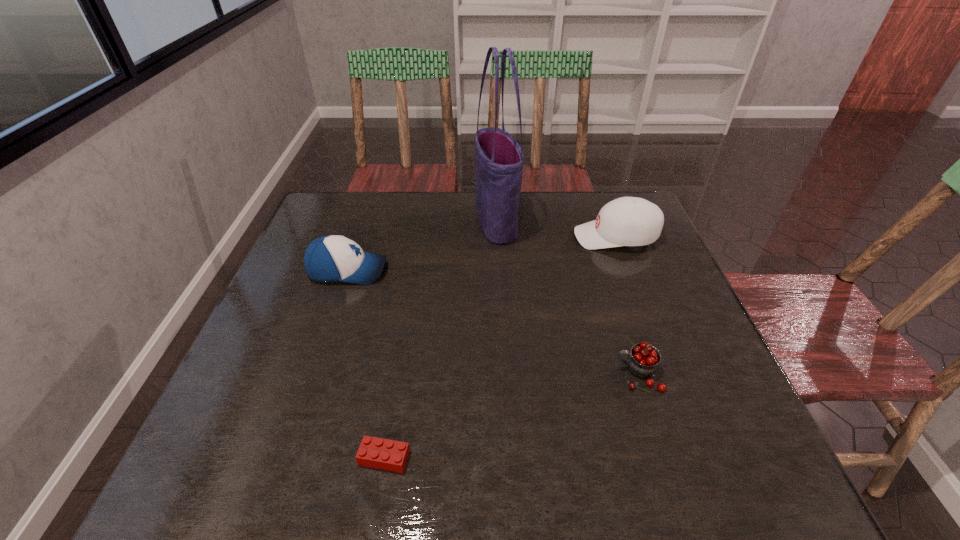
The width and height of the screenshot is (960, 540). I want to click on vacant space that satisfies the following two spatial constraints: 1. on the front-facing side of the leftmost object; 2. on the right side of the Lego, so click(x=284, y=457).